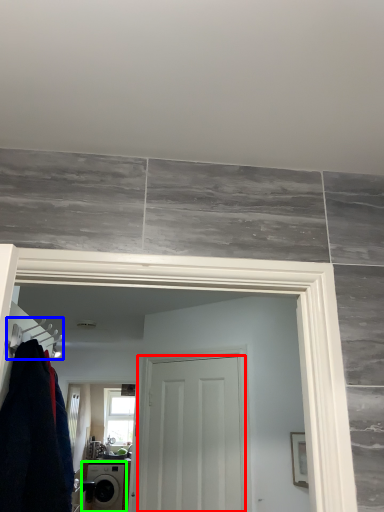
Question: Which is farther away from door (highlighted by a red box)? hanger (highlighted by a blue box) or washing machine (highlighted by a green box)?

Choices:
 (A) hanger
 (B) washing machine

Answer: (B)